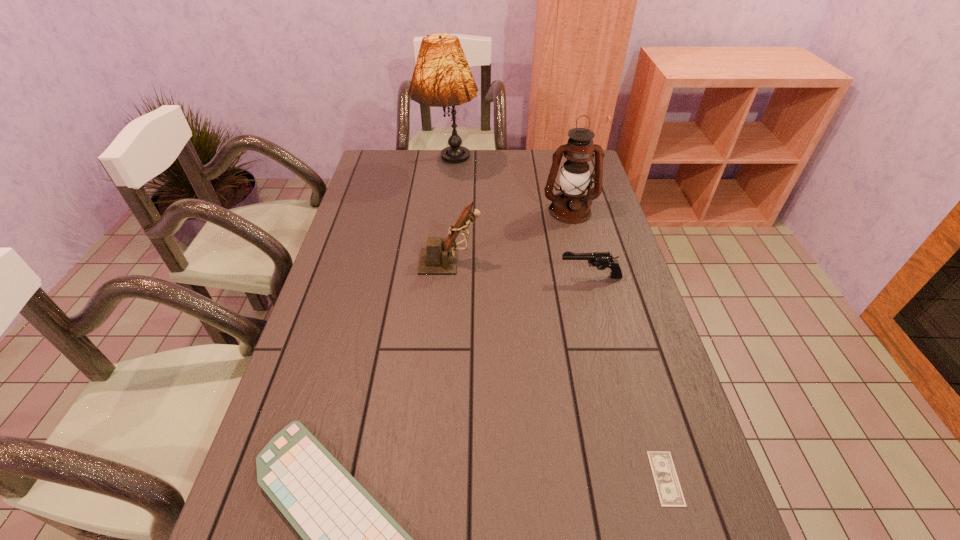
Locate an element on the screen. This screenshot has width=960, height=540. vacant space located 0.140m at the end of the barrel of the fourth tallest object is located at coordinates (511, 277).

Locate an element on the screen. This screenshot has height=540, width=960. blank space located at the end of the barrel of the fourth tallest object is located at coordinates (479, 277).

Identify the location of free space located 0.050m at the end of the barrel of the fourth tallest object. (541, 277).

This screenshot has height=540, width=960. I want to click on free space located 0.330m on the back of the money, so click(621, 326).

What are the coordinates of `object present at the far edge` in the screenshot? It's located at (442, 77).

At what (x,y) coordinates should I click in order to perform the action: click on lantern situated at the right edge. Please return your answer as a coordinate pair (x, y). Image resolution: width=960 pixels, height=540 pixels. Looking at the image, I should click on (571, 206).

Identify the location of gun situated at the right edge. (602, 260).

Find the location of `money that is at the right edge`. money that is at the right edge is located at coordinates (670, 494).

This screenshot has width=960, height=540. I want to click on vacant space at the far edge, so click(x=432, y=156).

In the image, there is a desktop. Identify the location of vacant space at the left edge. (342, 273).